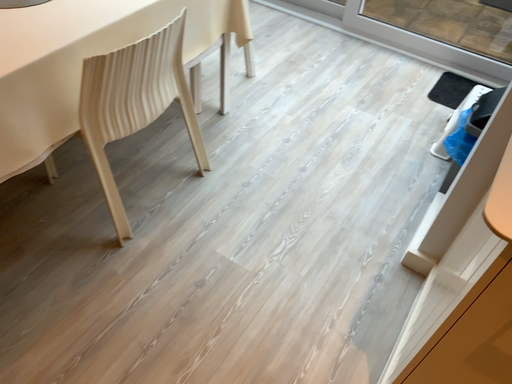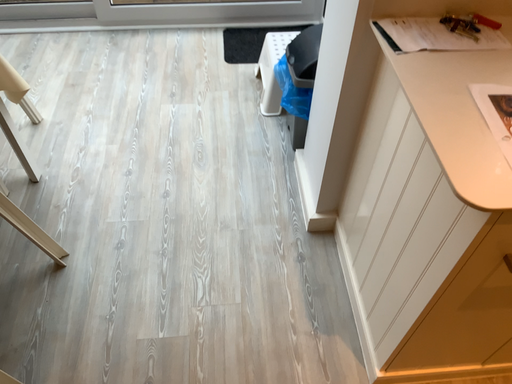
Question: Which way did the camera rotate in the video?

Choices:
 (A) rotated left
 (B) rotated right

Answer: (B)